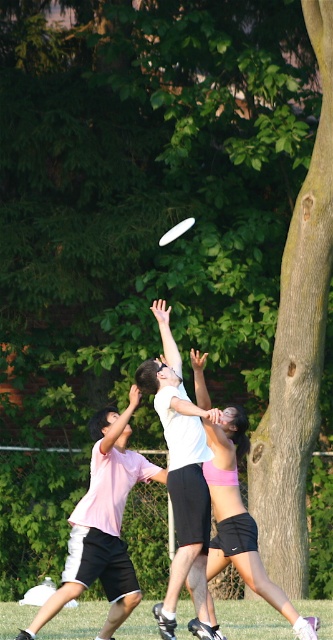
Question: Which point is farther to the camera?

Choices:
 (A) (159, 243)
 (B) (236, 566)

Answer: (A)

Question: Among these points, which one is farthest from the camera?

Choices:
 (A) [x=178, y=225]
 (B) [x=149, y=381]
 (C) [x=119, y=419]

Answer: (A)

Question: Is white matte shirt at center to the right of pink fabric shorts at center from the viewer's perspective?

Choices:
 (A) no
 (B) yes

Answer: (A)

Question: Is pink matte shirt at center further to camera compared to pink fabric shorts at center?

Choices:
 (A) no
 (B) yes

Answer: (A)

Question: Is pink matte shirt at center thinner than white plastic frisbee at upper center?

Choices:
 (A) no
 (B) yes

Answer: (A)

Question: Which of the following is the closest to the observer?

Choices:
 (A) (177, 449)
 (B) (109, 515)
 (C) (240, 554)
 (D) (193, 221)

Answer: (A)